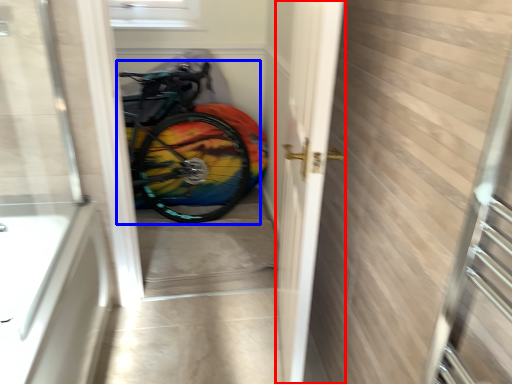
Question: Which point is closer to the camera, screen door (highlighted by a red box) or bicycle (highlighted by a blue box)?

Choices:
 (A) screen door
 (B) bicycle

Answer: (A)